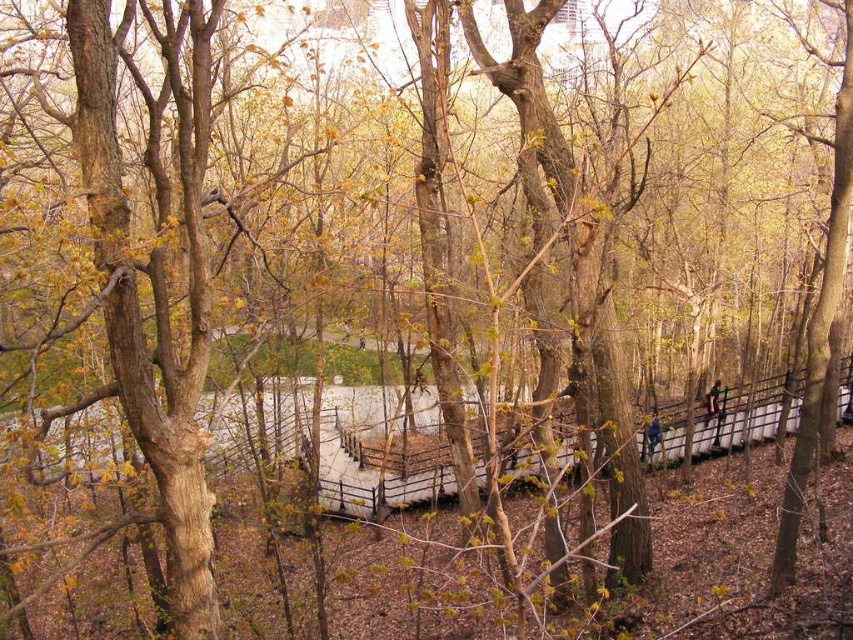
Does blue denim jeans at right have a lesser width compared to dark brown leather jacket at center-right?

Incorrect, blue denim jeans at right's width is not less than dark brown leather jacket at center-right's.

Between point (654, 451) and point (708, 403), which one is positioned in front?

Point (654, 451) is more forward.

What are the coordinates of `blue denim jeans at right` in the screenshot? It's located at (650, 435).